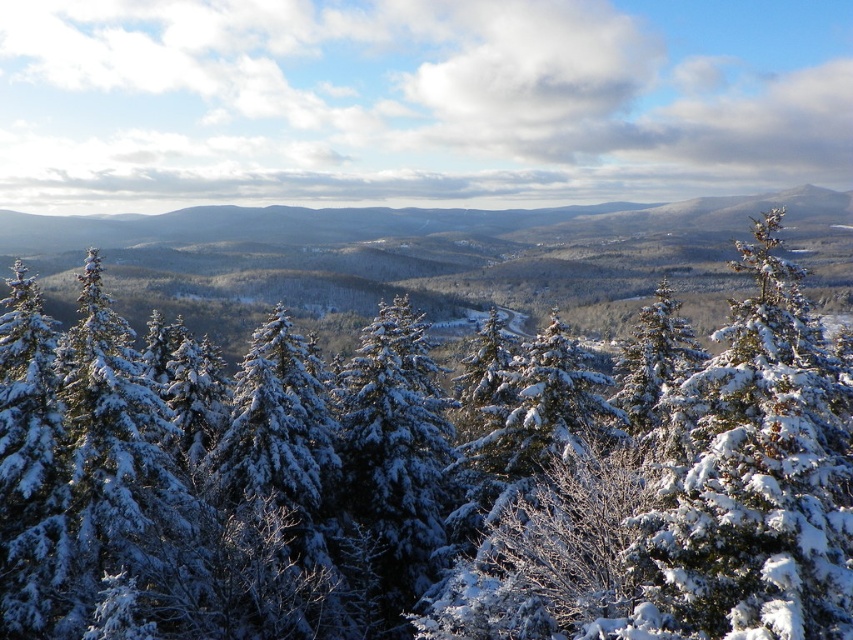
Can you confirm if green textured pine at center is bigger than white snow-covered mountain at center?

No.

This screenshot has width=853, height=640. What do you see at coordinates (426, 477) in the screenshot? I see `green textured pine at center` at bounding box center [426, 477].

Between point (105, 304) and point (804, 188), which one is positioned in front?

Point (105, 304) is in front.

Locate an element on the screen. Image resolution: width=853 pixels, height=640 pixels. green textured pine at center is located at coordinates (426, 477).

Can you confirm if white snow-covered mountain at center is positioned above snow-covered evergreen at center-right?

Indeed, white snow-covered mountain at center is positioned over snow-covered evergreen at center-right.

Can you confirm if white snow-covered mountain at center is taller than snow-covered evergreen at center-right?

Indeed, white snow-covered mountain at center has a greater height compared to snow-covered evergreen at center-right.

What do you see at coordinates (428, 259) in the screenshot? This screenshot has width=853, height=640. I see `white snow-covered mountain at center` at bounding box center [428, 259].

Locate an element on the screen. This screenshot has height=640, width=853. white snow-covered mountain at center is located at coordinates (428, 259).

Does point (433, 387) lie behind point (717, 422)?

Yes, point (433, 387) is farther from viewer.

Who is shorter, green textured pine at center or snow-covered evergreen at center-right?

With less height is snow-covered evergreen at center-right.

Measure the distance between point (x=796, y=563) and camera.

Point (x=796, y=563) is 15.25 meters away from camera.

The image size is (853, 640). I want to click on green textured pine at center, so click(426, 477).